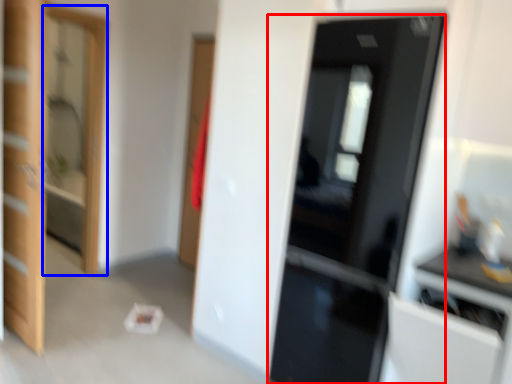
Question: Which object is closer to the camera taking this photo, door (highlighted by a red box) or screen door (highlighted by a blue box)?

Choices:
 (A) door
 (B) screen door

Answer: (A)